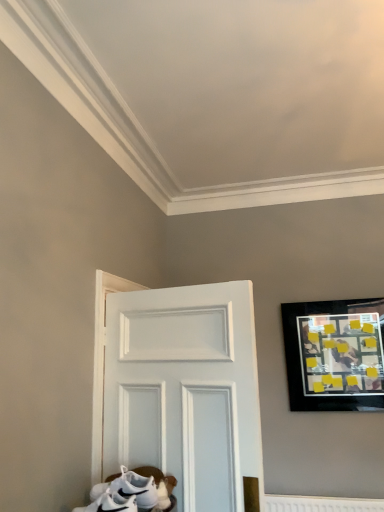
Measure the distance between point (107, 486) and camera.

1.85 meters.

This screenshot has width=384, height=512. What are the coordinates of `white matte sneakers at lower left` in the screenshot? It's located at (132, 490).

This screenshot has width=384, height=512. What do you see at coordinates (132, 490) in the screenshot?
I see `white matte sneakers at lower left` at bounding box center [132, 490].

Describe the element at coordinates (335, 354) in the screenshot. This screenshot has height=512, width=384. I see `black matte picture frame at upper right` at that location.

Identify the location of black matte picture frame at upper right. (335, 354).

You are a GUI agent. You are given a task and a screenshot of the screen. Output one action in this format:
    pyautogui.click(x=<x>, y=<y>)
    Task: Click on the white matte sneakers at lower left
    The image size is (384, 512).
    Given the screenshot: What is the action you would take?
    pyautogui.click(x=132, y=490)

Would you say white matte sneakers at lower left is to the left or to the right of black matte picture frame at upper right in the picture?

In the image, white matte sneakers at lower left appears on the left side of black matte picture frame at upper right.

Is white matte sneakers at lower left positioned before black matte picture frame at upper right?

Yes, white matte sneakers at lower left is closer to the viewer.

Is point (84, 508) positioned behind point (308, 360)?

No, (84, 508) is closer to viewer.

From the image's perspective, does white matte sneakers at lower left appear lower than black matte picture frame at upper right?

Yes, from the image's perspective, white matte sneakers at lower left is beneath black matte picture frame at upper right.

From a real-world perspective, which object stands above the other?

black matte picture frame at upper right, from a real-world perspective.

Considering the relative sizes of white matte sneakers at lower left and black matte picture frame at upper right in the image provided, is white matte sneakers at lower left wider than black matte picture frame at upper right?

Yes, white matte sneakers at lower left is wider than black matte picture frame at upper right.

Can you confirm if white matte sneakers at lower left is taller than black matte picture frame at upper right?

No.

Based on the photo, who is bigger, white matte sneakers at lower left or black matte picture frame at upper right?

black matte picture frame at upper right is bigger.

Can black matte picture frame at upper right be found inside white matte sneakers at lower left?

No, white matte sneakers at lower left does not contain black matte picture frame at upper right.

Is white matte sneakers at lower left in contact with black matte picture frame at upper right?

white matte sneakers at lower left is not next to black matte picture frame at upper right, and they're not touching.

Is white matte sneakers at lower left positioned with its back to black matte picture frame at upper right?

white matte sneakers at lower left is not turned away from black matte picture frame at upper right.

How different are the orientations of white matte sneakers at lower left and black matte picture frame at upper right in degrees?

There is a 92.9-degree angle between the facing directions of white matte sneakers at lower left and black matte picture frame at upper right.

At what (x,y) coordinates should I click in order to perform the action: click on footwear lying below the black matte picture frame at upper right (from the image's perspective). Please return your answer as a coordinate pair (x, y). Looking at the image, I should click on (132, 490).

Which is more to the left, black matte picture frame at upper right or white matte sneakers at lower left?

white matte sneakers at lower left.

Is black matte picture frame at upper right in front of or behind white matte sneakers at lower left in the image?

Clearly, black matte picture frame at upper right is behind white matte sneakers at lower left.

Which is behind, point (338, 317) or point (88, 505)?

Point (338, 317)

From the image's perspective, is black matte picture frame at upper right located above white matte sneakers at lower left?

Indeed, from the image's perspective, black matte picture frame at upper right is shown above white matte sneakers at lower left.

From the picture: From a real-world perspective, is black matte picture frame at upper right positioned above or below white matte sneakers at lower left?

From a real-world perspective, black matte picture frame at upper right is physically above white matte sneakers at lower left.

In terms of width, does black matte picture frame at upper right look wider or thinner when compared to white matte sneakers at lower left?

Clearly, black matte picture frame at upper right has less width compared to white matte sneakers at lower left.

Consider the image. Does black matte picture frame at upper right have a lesser height compared to white matte sneakers at lower left?

In fact, black matte picture frame at upper right may be taller than white matte sneakers at lower left.

Between black matte picture frame at upper right and white matte sneakers at lower left, which one has larger size?

black matte picture frame at upper right.

Would you say white matte sneakers at lower left is part of black matte picture frame at upper right's contents?

Actually, white matte sneakers at lower left is outside black matte picture frame at upper right.

Does black matte picture frame at upper right touch white matte sneakers at lower left?

No, black matte picture frame at upper right is not beside white matte sneakers at lower left.

Is black matte picture frame at upper right oriented away from white matte sneakers at lower left?

No, black matte picture frame at upper right is not facing the opposite direction of white matte sneakers at lower left.

How many degrees apart are the facing directions of black matte picture frame at upper right and white matte sneakers at lower left?

The angular difference between black matte picture frame at upper right and white matte sneakers at lower left is 92.9 degrees.

How distant is black matte picture frame at upper right from white matte sneakers at lower left?

black matte picture frame at upper right and white matte sneakers at lower left are 1.82 meters apart from each other.

Locate an element on the screen. This screenshot has width=384, height=512. footwear located below the black matte picture frame at upper right (from the image's perspective) is located at coordinates (132, 490).

Where is `footwear that is in front of the black matte picture frame at upper right`? footwear that is in front of the black matte picture frame at upper right is located at coordinates (132, 490).

Locate an element on the screen. The width and height of the screenshot is (384, 512). footwear on the left side of black matte picture frame at upper right is located at coordinates (132, 490).